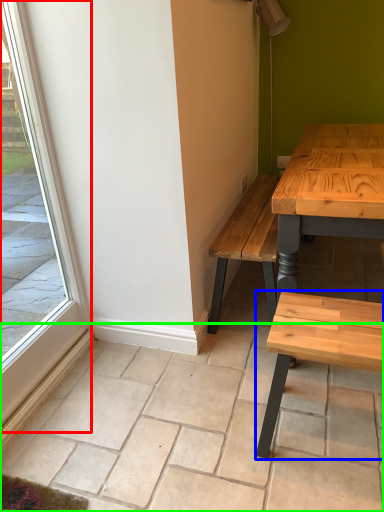
Question: Considering the real-world distances, which object is closest to window (highlighted by a red box)? coffee table (highlighted by a blue box) or tile (highlighted by a green box).

Choices:
 (A) coffee table
 (B) tile

Answer: (B)